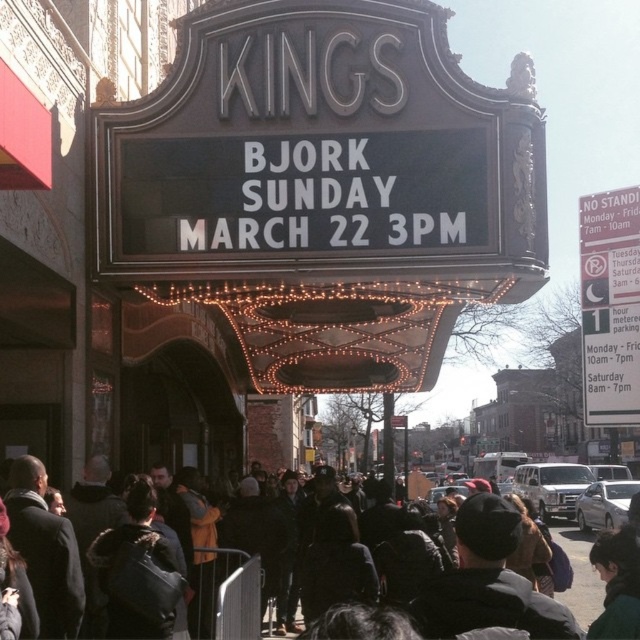
Question: Can you confirm if white paper sign at right is bigger than dark gray jacket at center?

Choices:
 (A) no
 (B) yes

Answer: (A)

Question: Is white paper sign at right below dark gray jacket at center?

Choices:
 (A) yes
 (B) no

Answer: (B)

Question: Is white paper sign at right further to the viewer compared to dark gray jacket at center?

Choices:
 (A) no
 (B) yes

Answer: (B)